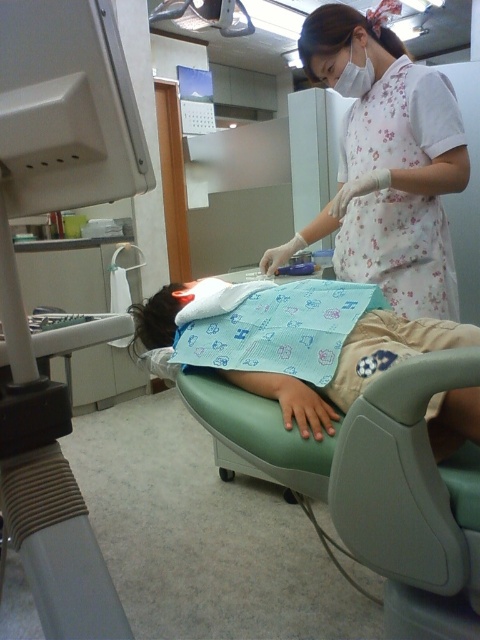
Question: Does white floral uniform at upper right have a larger size compared to blue fabric at center?

Choices:
 (A) yes
 (B) no

Answer: (A)

Question: Among these objects, which one is nearest to the camera?

Choices:
 (A) beige rubber dental chair at left
 (B) white floral uniform at upper right
 (C) blue fabric at center

Answer: (A)

Question: Is beige rubber dental chair at left positioned behind blue fabric at center?

Choices:
 (A) yes
 (B) no

Answer: (B)

Question: Which of the following is the closest to the observer?

Choices:
 (A) (69, 486)
 (B) (371, 321)

Answer: (A)

Question: Estimate the real-world distances between objects in this image. Which object is farther from the white floral uniform at upper right?

Choices:
 (A) beige rubber dental chair at left
 (B) blue fabric at center

Answer: (A)

Question: Is beige rubber dental chair at left smaller than blue fabric at center?

Choices:
 (A) no
 (B) yes

Answer: (A)